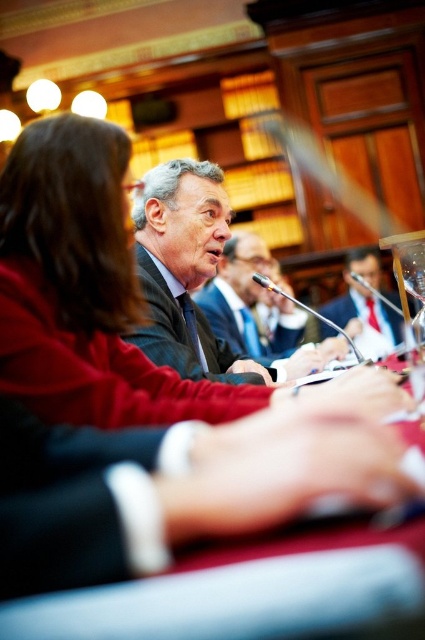
Question: Which point is farther from the camera taking this photo?

Choices:
 (A) (371, 333)
 (B) (2, 502)
 (C) (178, 172)

Answer: (A)

Question: Is smooth red table at center positioned in front of dark gray suit at center?

Choices:
 (A) no
 (B) yes

Answer: (B)

Question: Considering the real-world distances, which object is farthest from the dark suit at center?

Choices:
 (A) matte black suit at center
 (B) dark gray suit at center
 (C) smooth red table at center

Answer: (C)

Question: Is smooth red table at center closer to the viewer compared to dark gray suit at center?

Choices:
 (A) no
 (B) yes

Answer: (B)

Question: Does smooth red table at center appear on the right side of matte black suit at center?

Choices:
 (A) yes
 (B) no

Answer: (B)

Question: Considering the real-world distances, which object is closest to the dark gray suit at center?

Choices:
 (A) smooth red table at center
 (B) matte black suit at center

Answer: (A)